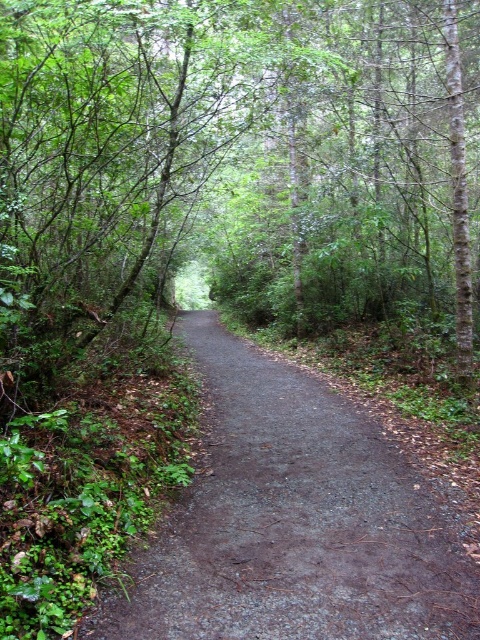
Question: Is green leafy tree at center to the right of dirt/gravel path at center from the viewer's perspective?

Choices:
 (A) no
 (B) yes

Answer: (A)

Question: Does green leafy tree at center come in front of dirt/gravel path at center?

Choices:
 (A) no
 (B) yes

Answer: (A)

Question: Does green leafy tree at center have a greater width compared to dirt/gravel path at center?

Choices:
 (A) no
 (B) yes

Answer: (B)

Question: Which point appears closest to the camera in this image?

Choices:
 (A) (104, 28)
 (B) (146, 614)

Answer: (B)

Question: Which point is farther to the camera?

Choices:
 (A) green leafy tree at center
 (B) dirt/gravel path at center

Answer: (A)